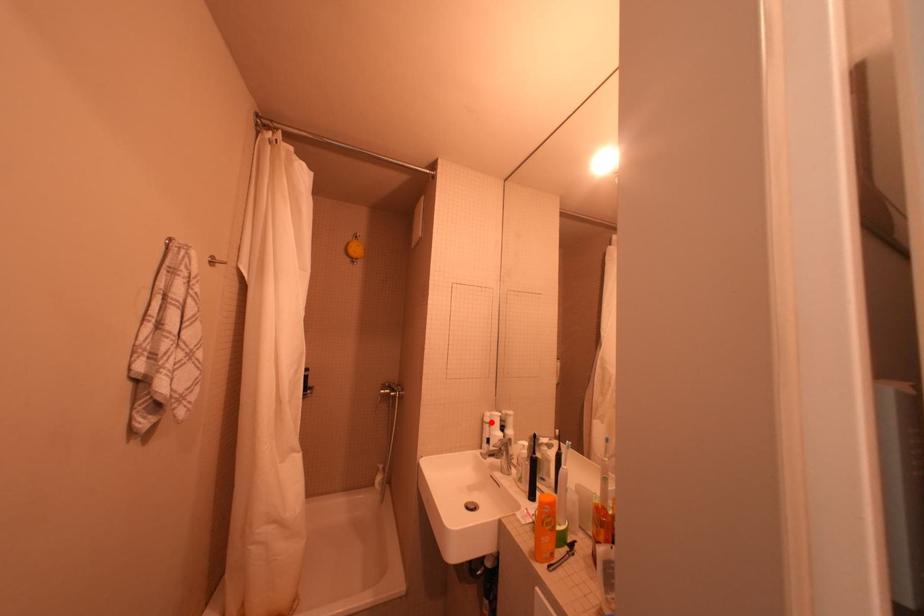
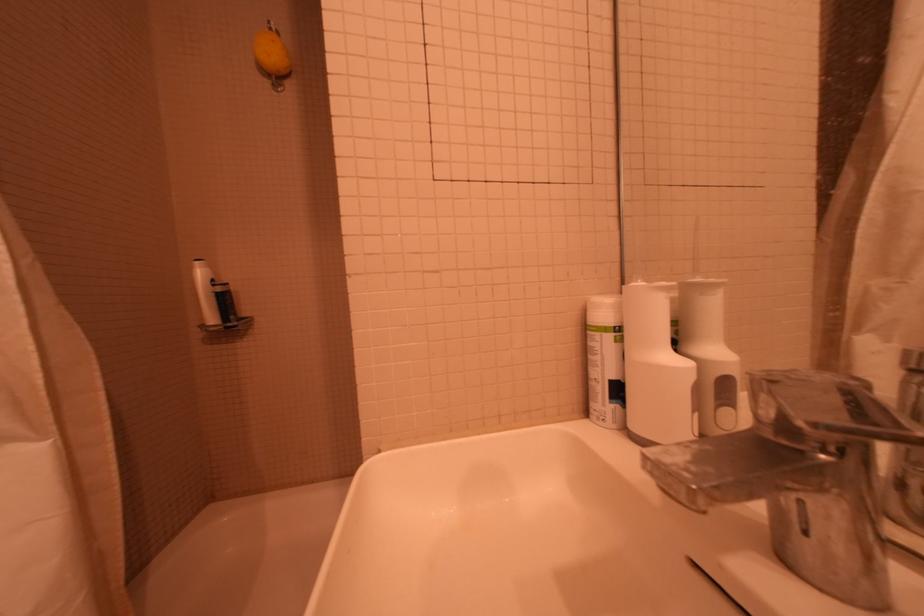
Question: I am providing you with two images of the same scene from different viewpoints. Given a red point in image1, look at the same physical point in image2. Is it:

Choices:
 (A) Closer to the viewpoint
 (B) Farther from the viewpoint

Answer: (A)